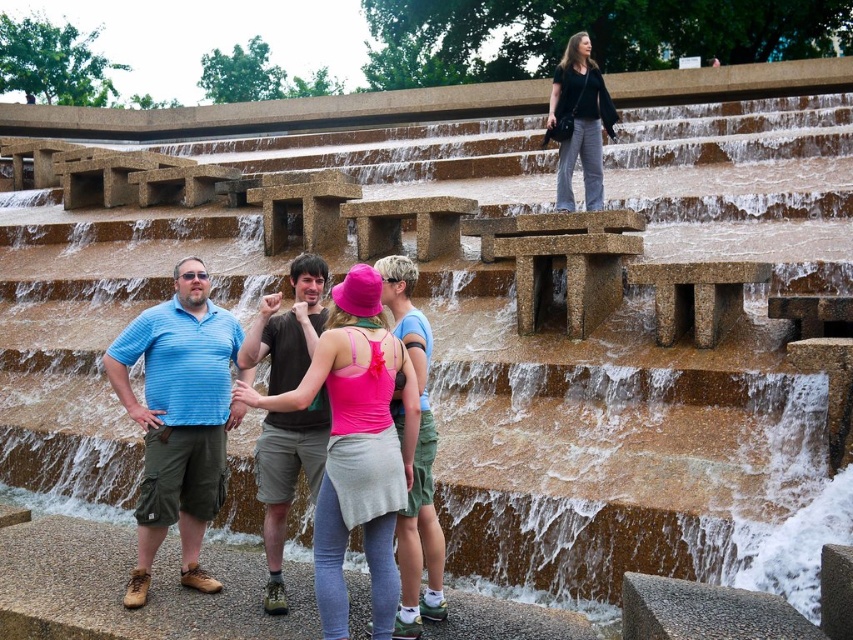
Consider the image. Can you confirm if blue striped polo shirt at center is smaller than black cotton shirt at upper right?

Yes.

What do you see at coordinates (178, 419) in the screenshot?
I see `blue striped polo shirt at center` at bounding box center [178, 419].

What are the coordinates of `blue striped polo shirt at center` in the screenshot? It's located at (178, 419).

Which is above, pink fabric hat at center or black cotton shirt at upper right?

black cotton shirt at upper right is above.

What do you see at coordinates (357, 445) in the screenshot? I see `pink fabric hat at center` at bounding box center [357, 445].

Find the location of a particular element. This screenshot has height=640, width=853. pink fabric hat at center is located at coordinates (357, 445).

From the picture: Can you confirm if pink fabric hat at center is positioned to the right of pink fabric tank top at center?

Incorrect, pink fabric hat at center is not on the right side of pink fabric tank top at center.

Between point (364, 406) and point (395, 323), which one is positioned behind?

Point (395, 323)

Is point (383, 369) positioned in front of point (383, 280)?

Yes, point (383, 369) is in front of point (383, 280).

At what (x,y) coordinates should I click in order to perform the action: click on pink fabric hat at center. Please return your answer as a coordinate pair (x, y). Looking at the image, I should click on tap(357, 445).